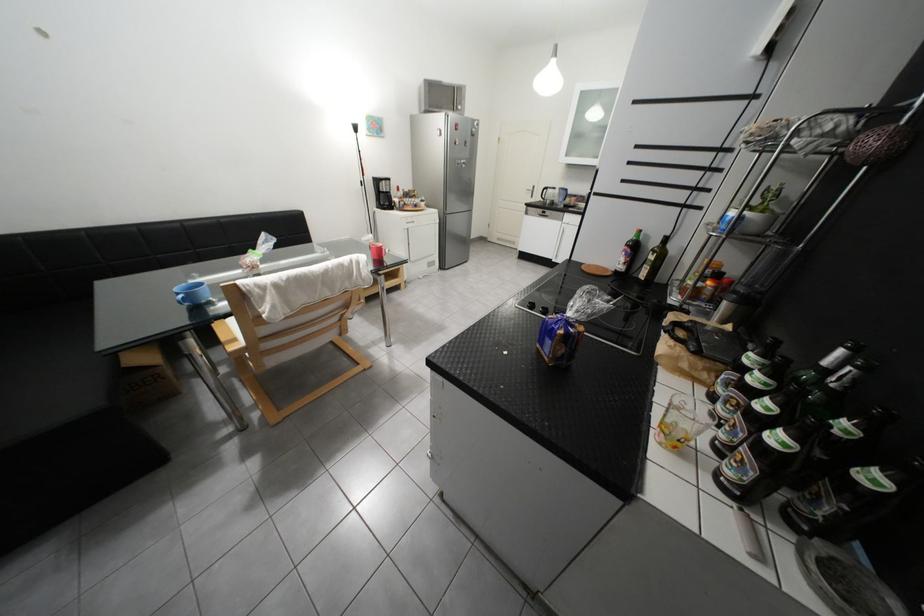
Locate an element on the screen. The image size is (924, 616). green wine bottle is located at coordinates (821, 371).